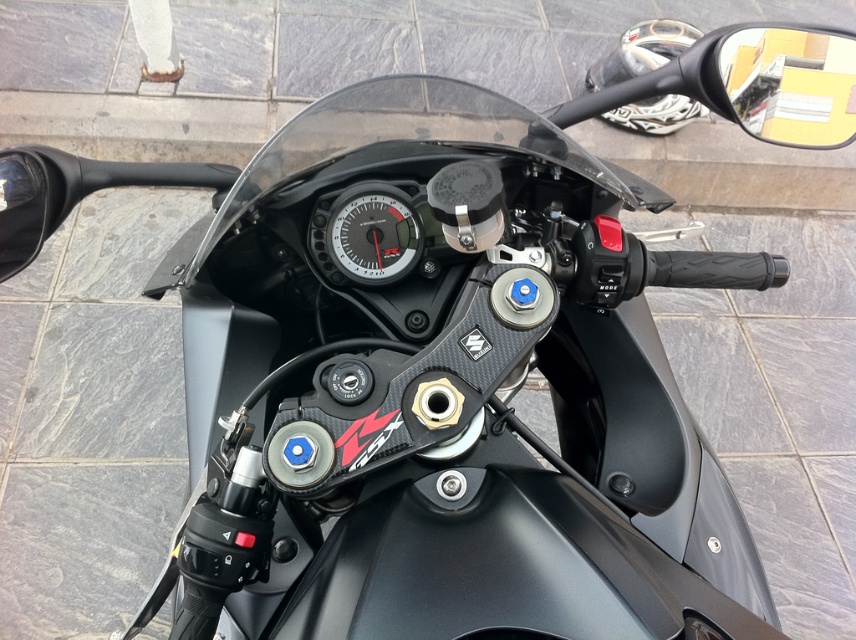
You are a photographer taking a closeup shot of the motorcycle handlebars. You notice two points marked on the motorcycle. The first point is at coordinate point (687, 52) and the second is at point (352, 193). Which point is closer to your camera lens?

Point (352, 193) is closer to the camera lens because it is less further than point (687, 52).

You are a motorcycle mechanic working on a Suzuki GSX sportbike. You need to install a new side mirror that must be positioned exactly 36 inches away from the rider for optimal visibility. The current yellow matte side mirror at upper right is installed. Is the current mirror positioned correctly?

The yellow matte side mirror at upper right is 37.30 inches from viewer, which is 1.30 inches further than the required 36 inches. Therefore, the current mirror is not positioned correctly and needs adjustment to meet the 36 inch requirement.

You are a motorcycle mechanic inspecting the front of the motorcycle. You need to determine which object has a greater width between the yellow matte side mirror at upper right and the matte black speedometer at center. Which one is wider?

The yellow matte side mirror at upper right has a larger width than the matte black speedometer at center according to the description.